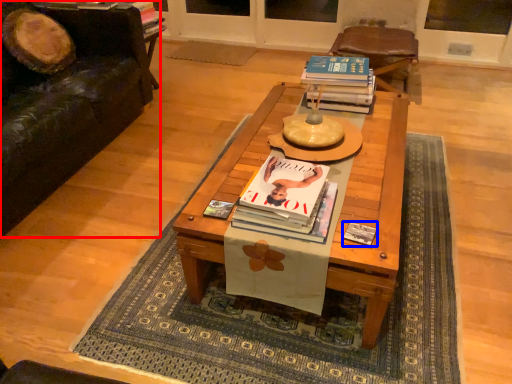
Question: Which of the following is the closest to the observer, studio couch (highlighted by a red box) or paperback book (highlighted by a blue box)?

Choices:
 (A) studio couch
 (B) paperback book

Answer: (B)